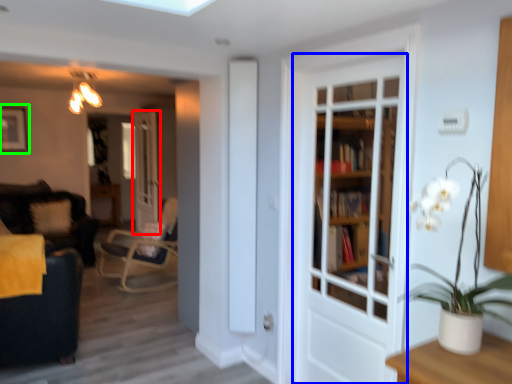
Question: Estimate the real-world distances between objects in this image. Which object is farther from door (highlighted by a red box), door (highlighted by a blue box) or picture frame (highlighted by a green box)?

Choices:
 (A) door
 (B) picture frame

Answer: (A)